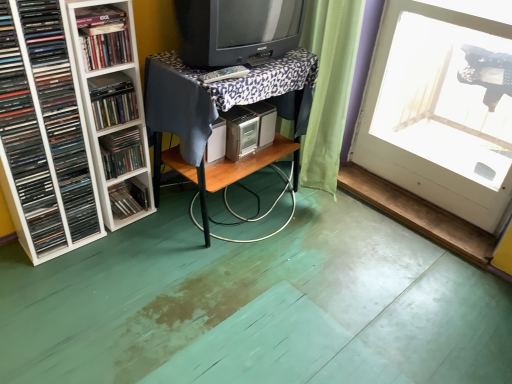
The image size is (512, 384). What are the coordinates of `vacant space in front of matte black cd case at lower left, positioned as the first book in bottom-to-top order` in the screenshot? It's located at (115, 236).